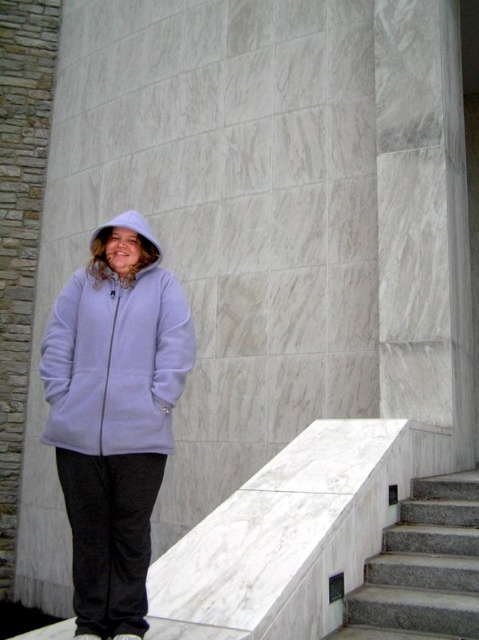
Question: Is purple fleece jacket at center to the right of lavender fleece jacket at center from the viewer's perspective?

Choices:
 (A) no
 (B) yes

Answer: (A)

Question: Can you confirm if gray granite stairs at lower right is positioned above white fleece hood at upper left?

Choices:
 (A) yes
 (B) no

Answer: (B)

Question: Estimate the real-world distances between objects in this image. Which object is farther from the purple fleece jacket at center?

Choices:
 (A) white fleece hood at upper left
 (B) lavender fleece jacket at center

Answer: (A)

Question: Which of the following is the closest to the observer?

Choices:
 (A) (402, 595)
 (B) (125, 221)
 (C) (102, 436)

Answer: (C)

Question: Is lavender fleece jacket at center below white fleece hood at upper left?

Choices:
 (A) yes
 (B) no

Answer: (A)

Question: Which of the following is the farthest from the observer?

Choices:
 (A) (93, 230)
 (B) (156, 451)
 (C) (451, 532)

Answer: (A)